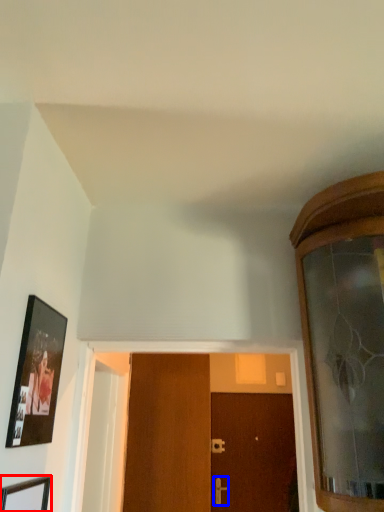
Question: Which point is further to the camera, picture frame (highlighted by a red box) or door handle (highlighted by a blue box)?

Choices:
 (A) picture frame
 (B) door handle

Answer: (B)